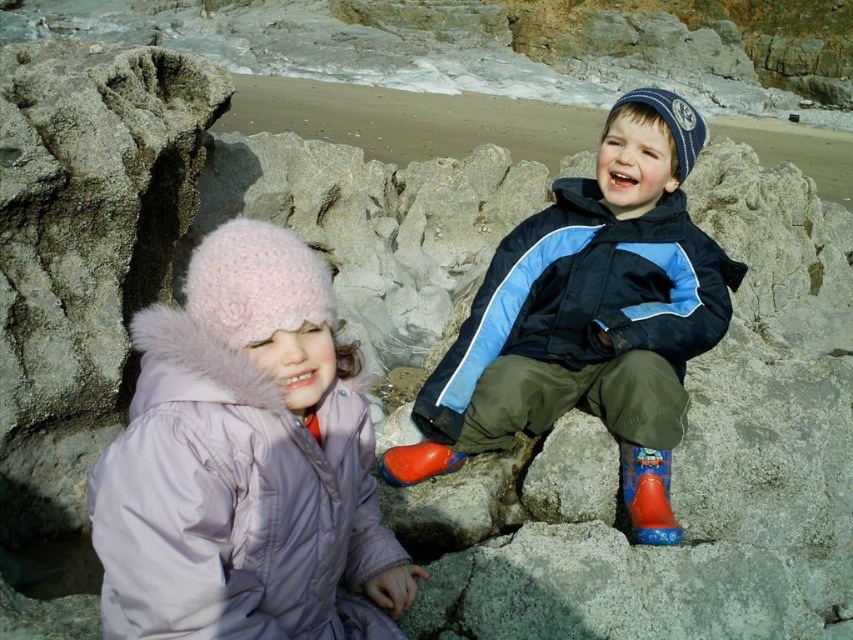
Question: Is blue and white jacket at center to the left of rubber/matte boot at lower center from the viewer's perspective?

Choices:
 (A) yes
 (B) no

Answer: (B)

Question: Is matte pink coat at left to the left of matte pink fur-lined coat at left from the viewer's perspective?

Choices:
 (A) yes
 (B) no

Answer: (B)

Question: Which object appears farthest from the camera in this image?

Choices:
 (A) blue and white jacket at center
 (B) matte pink coat at left

Answer: (A)

Question: Which of the following is the closest to the observer?

Choices:
 (A) matte pink fur-lined coat at left
 (B) blue and white jacket at center
 (C) red rubber boot at lower right

Answer: (A)

Question: Is matte pink coat at left bigger than blue and white jacket at center?

Choices:
 (A) no
 (B) yes

Answer: (B)

Question: Among these points, which one is nearest to the camera?

Choices:
 (A) (448, 426)
 (B) (595, 209)
 (C) (659, 522)

Answer: (C)